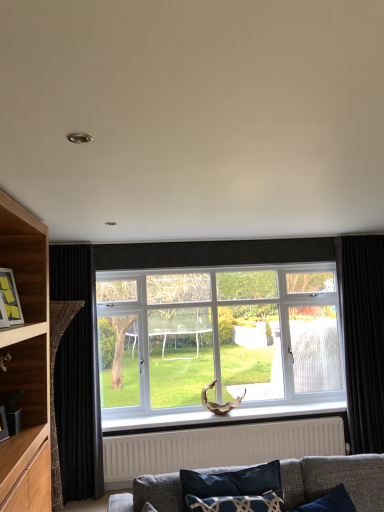
Question: From the image's perspective, is black velvet curtain at right, placed as the 1th curtain when sorted from right to left, over white textured radiator at lower center?

Choices:
 (A) no
 (B) yes

Answer: (B)

Question: Is black velvet curtain at right, placed as the 1th curtain when sorted from right to left, with white textured radiator at lower center?

Choices:
 (A) no
 (B) yes

Answer: (A)

Question: From a real-world perspective, is black velvet curtain at right, placed as the 1th curtain when sorted from right to left, under white textured radiator at lower center?

Choices:
 (A) no
 (B) yes

Answer: (A)

Question: Can you confirm if black velvet curtain at right, which ranks as the second curtain in left-to-right order, is bigger than white textured radiator at lower center?

Choices:
 (A) no
 (B) yes

Answer: (B)

Question: Can you confirm if black velvet curtain at right, placed as the 1th curtain when sorted from right to left, is shorter than white textured radiator at lower center?

Choices:
 (A) no
 (B) yes

Answer: (A)

Question: Is velvet dark blue pillow at lower center in front of or behind white textured radiator at lower center in the image?

Choices:
 (A) behind
 (B) front

Answer: (B)

Question: From their relative heights in the image, would you say velvet dark blue pillow at lower center is taller or shorter than white textured radiator at lower center?

Choices:
 (A) tall
 (B) short

Answer: (B)

Question: From the image's perspective, is velvet dark blue pillow at lower center positioned above or below white textured radiator at lower center?

Choices:
 (A) below
 (B) above

Answer: (B)

Question: Is point (253, 509) positioned closer to the camera than point (256, 430)?

Choices:
 (A) closer
 (B) farther

Answer: (A)

Question: Visually, is white textured radiator at lower center positioned to the left or to the right of velvet dark blue pillow at lower center?

Choices:
 (A) right
 (B) left

Answer: (A)

Question: From their relative heights in the image, would you say white textured radiator at lower center is taller or shorter than velvet dark blue pillow at lower center?

Choices:
 (A) tall
 (B) short

Answer: (A)

Question: Considering their positions, is white textured radiator at lower center located in front of or behind velvet dark blue pillow at lower center?

Choices:
 (A) behind
 (B) front

Answer: (A)

Question: Is white textured radiator at lower center inside or outside of velvet dark blue pillow at lower center?

Choices:
 (A) inside
 (B) outside

Answer: (B)

Question: Considering the positions of white plastic window at center and wooden frame at left in the image, is white plastic window at center bigger or smaller than wooden frame at left?

Choices:
 (A) big
 (B) small

Answer: (A)

Question: From the image's perspective, is white plastic window at center above or below wooden frame at left?

Choices:
 (A) below
 (B) above

Answer: (A)